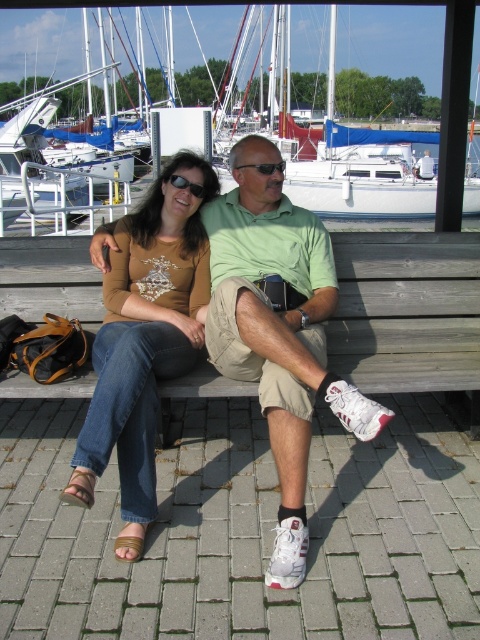
You are a photographer trying to capture a closeup of the matte brown leather shoes at lower center and the wooden bench at center. Since you want to focus on the shoes, which object should you position closer to the camera?

The matte brown leather shoes at lower center has a larger size compared to wooden bench at center, so you should position the matte brown leather shoes at lower center closer to the camera to ensure it takes up more of the frame and remains in focus.

You are a photographer standing at the edge of the marina, and you want to take a picture of both the wooden bench at center and the white glossy sailboat at center. Based on their positions, can you tell me which object is closer to the water surface?

The wooden bench at center is below the white glossy sailboat at center, so the wooden bench at center is closer to the water surface.